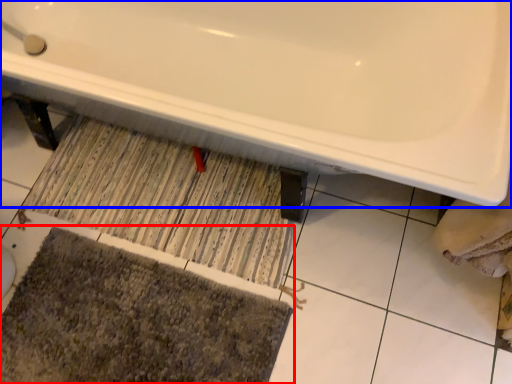
Question: Which object appears farthest to the camera in this image, bath mat (highlighted by a red box) or bathtub (highlighted by a blue box)?

Choices:
 (A) bath mat
 (B) bathtub

Answer: (A)